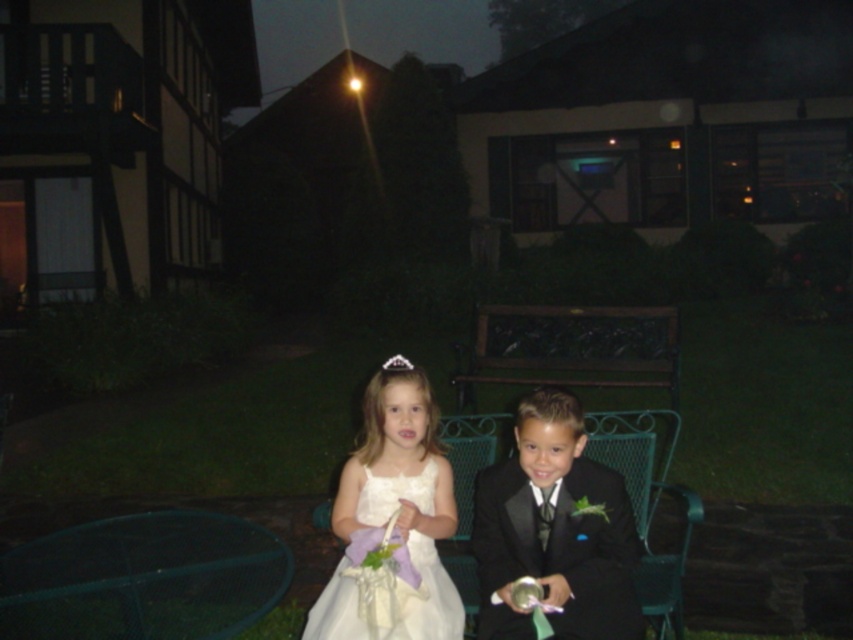
Question: Does shiny black suit at center appear over white satin dress at center?

Choices:
 (A) no
 (B) yes

Answer: (B)

Question: Among these objects, which one is farthest from the camera?

Choices:
 (A) shiny black suit at center
 (B) white satin dress at center

Answer: (B)

Question: Does shiny black suit at center appear on the right side of white satin dress at center?

Choices:
 (A) yes
 (B) no

Answer: (A)

Question: Does shiny black suit at center appear over white satin dress at center?

Choices:
 (A) yes
 (B) no

Answer: (A)

Question: Which object is closer to the camera taking this photo?

Choices:
 (A) white satin dress at center
 (B) shiny black suit at center

Answer: (B)